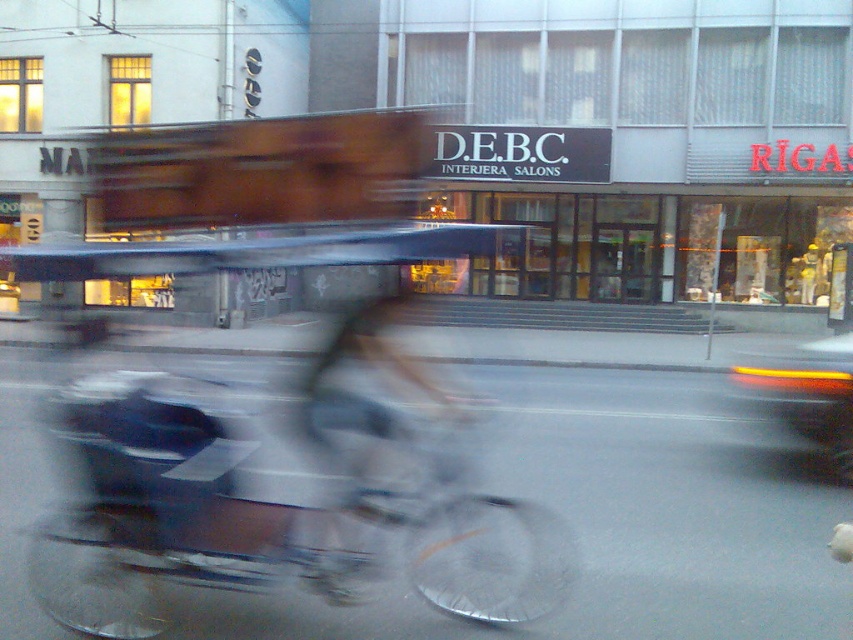
You are a delivery driver who needs to pass through the area between the metallic silver bicycle at center and the matte orange tail light at right. Your delivery vehicle is 2 meters wide. Can you safely navigate through this space?

The distance between the metallic silver bicycle at center and the matte orange tail light at right is 5.58 meters. Since your vehicle is 2 meters wide, there is sufficient space to safely navigate through the area between them.

What is the location of the point marked at coordinates (271, 516) in the image?

The point marked at coordinates (271, 516) is located on the metallic silver bicycle at center.

You are a delivery person who needs to fit your metallic silver bicycle at center and matte orange tail light at right into a storage locker that is 1.2 meters wide. Based on the scene description, will both items fit side by side?

The metallic silver bicycle at center is narrower than the matte orange tail light at right. However, since the total width of both items combined would exceed the locker width of 1.2 meters, they cannot fit side by side.